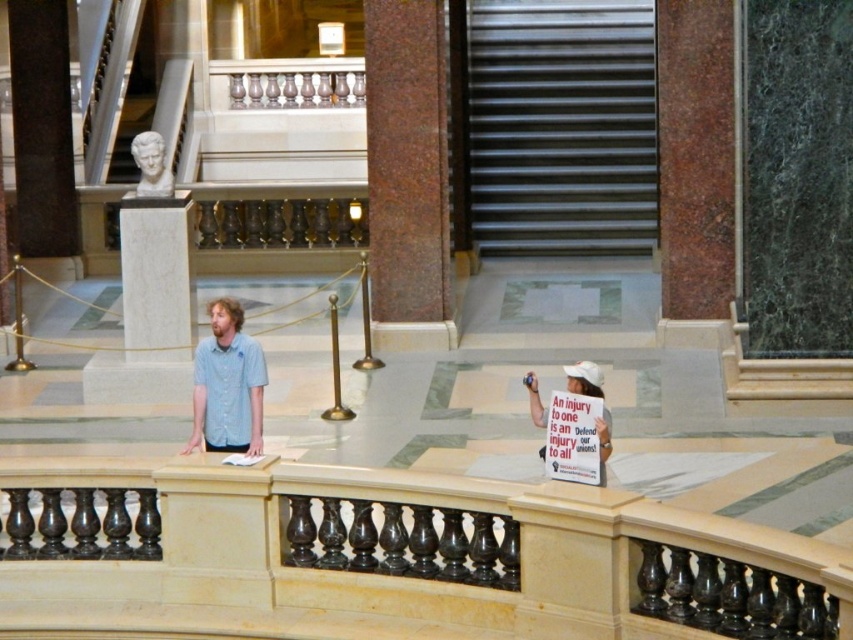
You are standing in the grand hall and want to locate both the light blue shirt at center and the white marble bust at upper left. Based on their positions, which object is closer to your left side?

The white marble bust at upper left is closer to your left side since it is positioned to the left of the light blue shirt at center.

You are a guest at this event and want to take a photo of the light blue shirt at center and the white marble bust at upper left. Which object is closer to the camera based on their positions?

The light blue shirt at center is positioned under the white marble bust at upper left, so the white marble bust at upper left is closer to the camera.